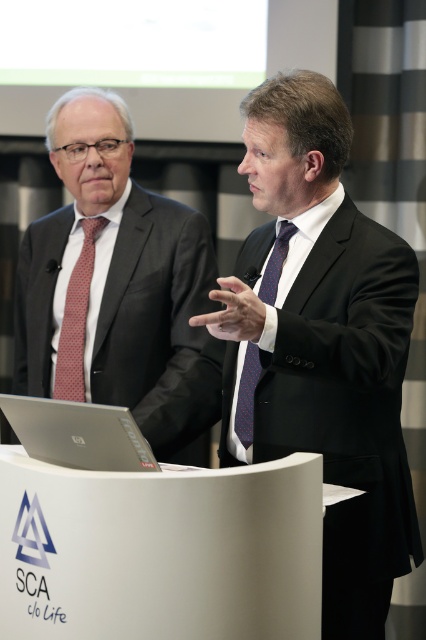
Question: Which point is farther to the camera?

Choices:
 (A) (86, 460)
 (B) (256, 381)
 (C) (236, 337)

Answer: (B)

Question: Is white matte podium at center wider than matte black suit at left?

Choices:
 (A) yes
 (B) no

Answer: (B)

Question: Does silver metallic laptop at lower left have a lesser width compared to red dotted tie at left?

Choices:
 (A) no
 (B) yes

Answer: (A)

Question: Observing the image, what is the correct spatial positioning of white matte podium at center in reference to red dotted tie at left?

Choices:
 (A) left
 (B) right

Answer: (B)

Question: Which of the following is the closest to the observer?

Choices:
 (A) blue silk tie at center
 (B) matte black suit at left

Answer: (A)

Question: Which point is farther to the camera?

Choices:
 (A) (331, 609)
 (B) (247, 448)
 (C) (55, 609)
 (D) (77, 268)

Answer: (D)